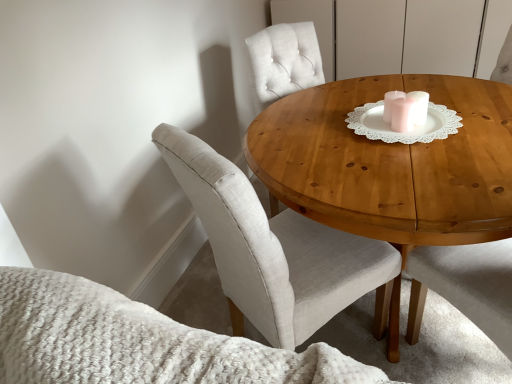
You are a GUI agent. You are given a task and a screenshot of the screen. Output one action in this format:
    pyautogui.click(x=<x>, y=<y>)
    Task: Click on the blank space to the left of white lace doily at center
    This screenshot has width=512, height=384.
    Given the screenshot: What is the action you would take?
    click(x=357, y=132)